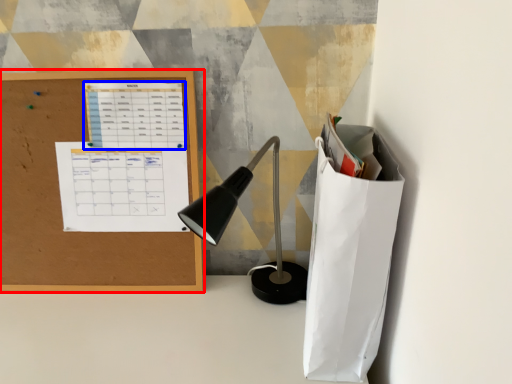
Question: Which object is closer to the camera taking this photo, office supplies (highlighted by a red box) or notebook (highlighted by a blue box)?

Choices:
 (A) office supplies
 (B) notebook

Answer: (A)